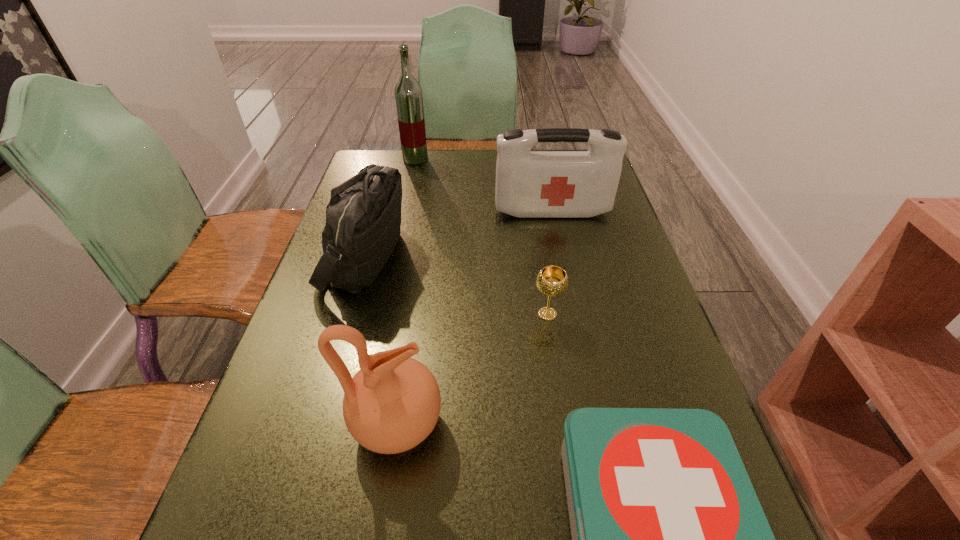
The image size is (960, 540). Identify the location of the tallest object. (408, 93).

Where is `liquor`? liquor is located at coordinates (408, 93).

Image resolution: width=960 pixels, height=540 pixels. Identify the location of pottery. (392, 404).

I want to click on shoulder bag, so click(363, 218).

The height and width of the screenshot is (540, 960). Identify the location of the farther first-aid kit. (529, 184).

Where is `chalice`? chalice is located at coordinates (552, 281).

You are a GUI agent. You are given a task and a screenshot of the screen. Output one action in this format:
    pyautogui.click(x=<x>, y=<y>)
    Task: Click on the vacant region located 0.200m on the right of the farthest object
    The width and height of the screenshot is (960, 540).
    Given the screenshot: What is the action you would take?
    pyautogui.click(x=488, y=159)

Identify the location of free space located on the spout of the pottery. (590, 424).

The height and width of the screenshot is (540, 960). Identify the location of free point located 0.380m at the front padded panel of the shoulder bag. (556, 256).

At what (x,y) coordinates should I click in order to perform the action: click on vacant position located 0.340m on the front side of the farther first-aid kit. Please return your answer as a coordinate pair (x, y). Looking at the image, I should click on (572, 309).